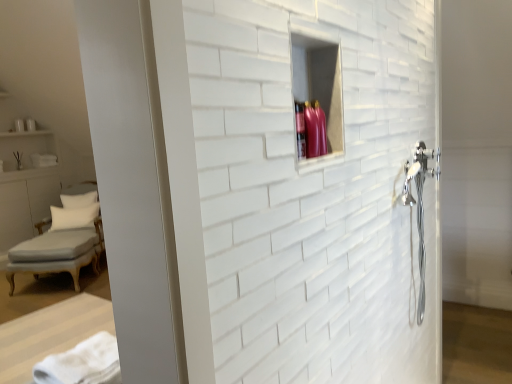
Question: From a real-world perspective, is white soft pillow at left, which is the 1th pillow in front-to-back order, positioned over light gray fabric chaise at lower left based on gravity?

Choices:
 (A) yes
 (B) no

Answer: (A)

Question: Considering the relative sizes of white soft pillow at left, which is the 1th pillow in front-to-back order, and light gray fabric chaise at lower left in the image provided, is white soft pillow at left, which is the 1th pillow in front-to-back order, bigger than light gray fabric chaise at lower left?

Choices:
 (A) yes
 (B) no

Answer: (B)

Question: From a real-world perspective, is white soft pillow at left, which is the 1th pillow in front-to-back order, under light gray fabric chaise at lower left?

Choices:
 (A) yes
 (B) no

Answer: (B)

Question: Is white soft pillow at left, which is the second pillow from back to front, to the right of light gray fabric chaise at lower left from the viewer's perspective?

Choices:
 (A) no
 (B) yes

Answer: (A)

Question: Could light gray fabric chaise at lower left be considered to be inside white soft pillow at left, which is the 1th pillow in front-to-back order?

Choices:
 (A) yes
 (B) no

Answer: (B)

Question: Considering the positions of point (109, 357) and point (95, 198), is point (109, 357) closer or farther from the camera than point (95, 198)?

Choices:
 (A) farther
 (B) closer

Answer: (B)

Question: In terms of size, does white soft towel at lower left appear bigger or smaller than white fabric pillow at left, which is the first pillow in back-to-front order?

Choices:
 (A) big
 (B) small

Answer: (B)

Question: Is white soft towel at lower left spatially inside white fabric pillow at left, which is the 2th pillow from front to back, or outside of it?

Choices:
 (A) inside
 (B) outside

Answer: (B)

Question: From the image's perspective, is white soft towel at lower left located above or below white fabric pillow at left, which is the first pillow in back-to-front order?

Choices:
 (A) above
 (B) below

Answer: (B)

Question: Is white soft pillow at left, which is the second pillow from back to front, bigger or smaller than white soft towel at lower left?

Choices:
 (A) big
 (B) small

Answer: (A)

Question: Based on their positions, is white soft pillow at left, which is the 1th pillow in front-to-back order, located to the left or right of white soft towel at lower left?

Choices:
 (A) left
 (B) right

Answer: (A)

Question: Considering their positions, is white soft pillow at left, which is the 1th pillow in front-to-back order, located in front of or behind white soft towel at lower left?

Choices:
 (A) front
 (B) behind

Answer: (B)

Question: Is white soft pillow at left, which is the 1th pillow in front-to-back order, wider or thinner than white soft towel at lower left?

Choices:
 (A) thin
 (B) wide

Answer: (A)

Question: Relative to white soft pillow at left, which is the 1th pillow in front-to-back order, is light gray fabric chaise at lower left in front or behind?

Choices:
 (A) behind
 (B) front

Answer: (B)

Question: Looking at the image, does light gray fabric chaise at lower left seem bigger or smaller compared to white soft pillow at left, which is the 1th pillow in front-to-back order?

Choices:
 (A) small
 (B) big

Answer: (B)